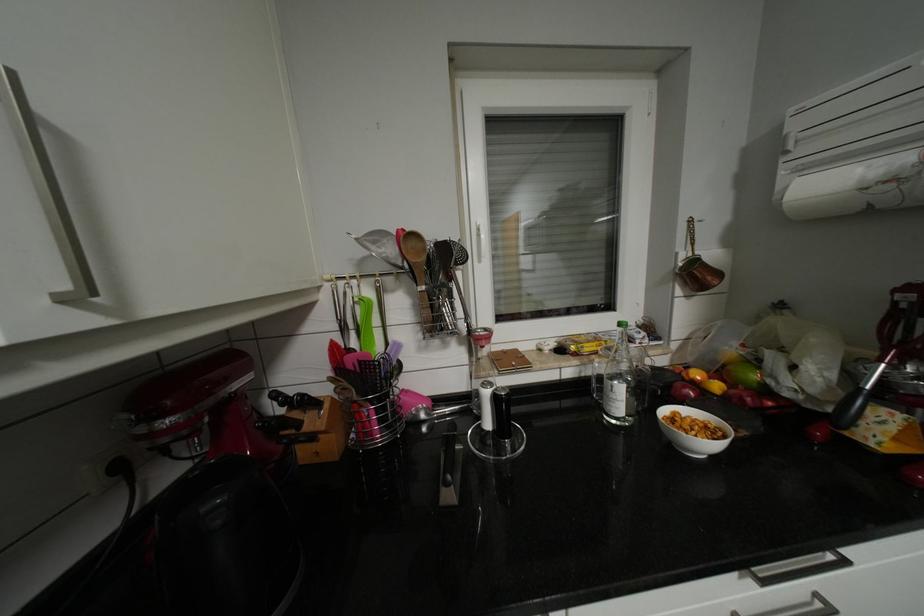
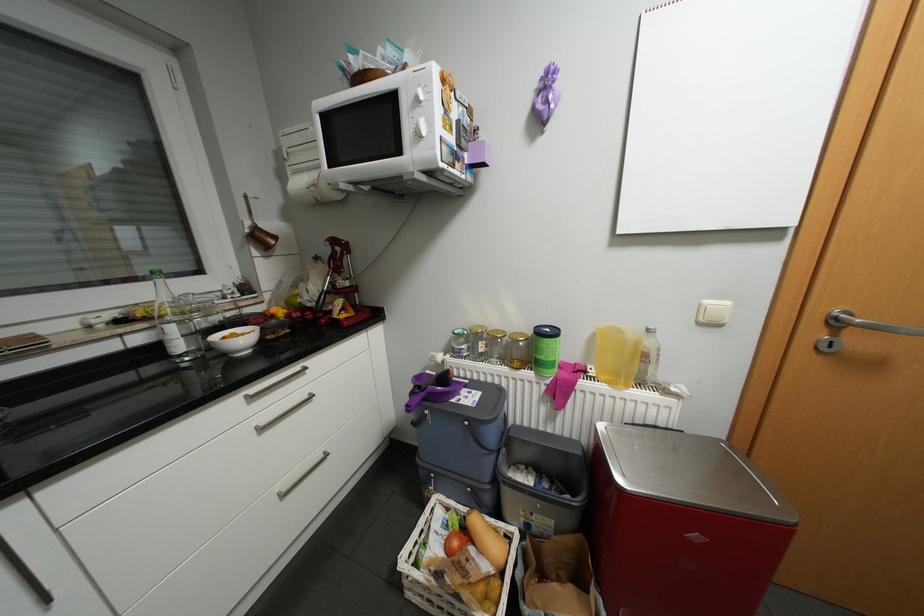
The point at [703,430] is marked in the first image. Where is the corresponding point in the second image?

(249, 339)